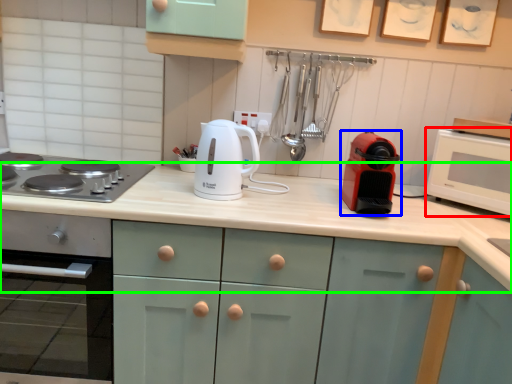
Question: Which is farther away from microwave oven (highlighted by a red box)? kitchen appliance (highlighted by a blue box) or countertop (highlighted by a green box)?

Choices:
 (A) kitchen appliance
 (B) countertop

Answer: (B)